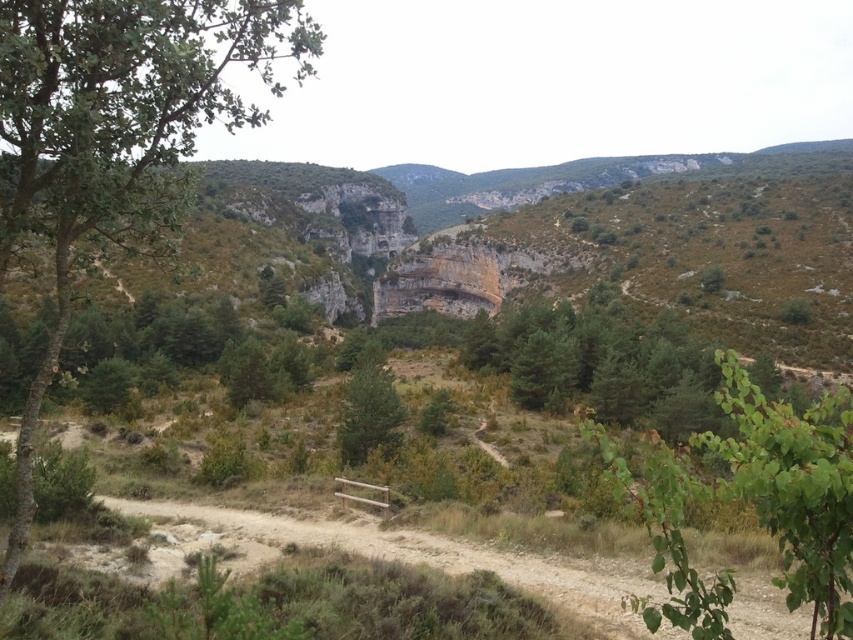
Is point (141, 186) less distant than point (398, 413)?

Yes.

Where is `green leafy tree at left`? The width and height of the screenshot is (853, 640). green leafy tree at left is located at coordinates (117, 134).

Does green leafy branch at lower right have a larger size compared to green matte tree at center?

Correct, green leafy branch at lower right is larger in size than green matte tree at center.

Who is positioned more to the right, green leafy branch at lower right or green matte tree at center?

green leafy branch at lower right is more to the right.

What are the coordinates of `green leafy branch at lower right` in the screenshot? It's located at (752, 504).

Does green leafy tree at left have a greater height compared to green leafy branch at lower right?

Yes.

Is green leafy tree at left behind green leafy branch at lower right?

Yes, green leafy tree at left is further from the viewer.

Is point (285, 52) less distant than point (811, 632)?

No, it is not.

Identify the location of green leafy tree at left. The height and width of the screenshot is (640, 853). click(x=117, y=134).